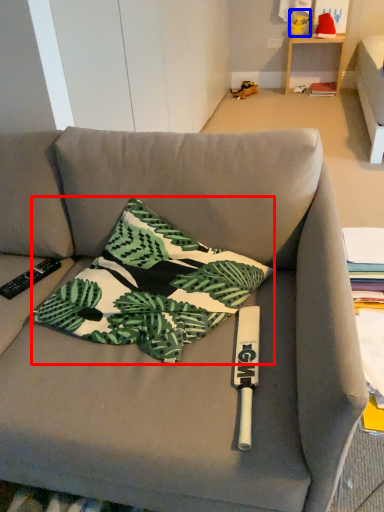
Question: Which of the following is the closest to the observer, pillow (highlighted by a red box) or toy (highlighted by a blue box)?

Choices:
 (A) pillow
 (B) toy

Answer: (A)